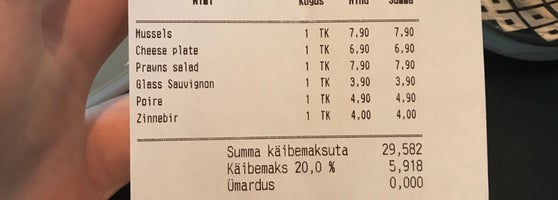
Where is `wall`? This screenshot has width=558, height=200. wall is located at coordinates (97, 82).